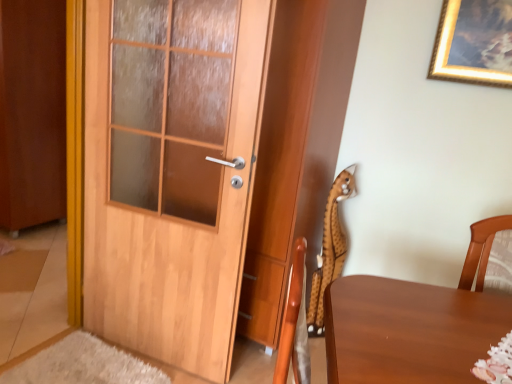
This screenshot has width=512, height=384. I want to click on vacant space to the left of wooden door at left, so click(x=79, y=359).